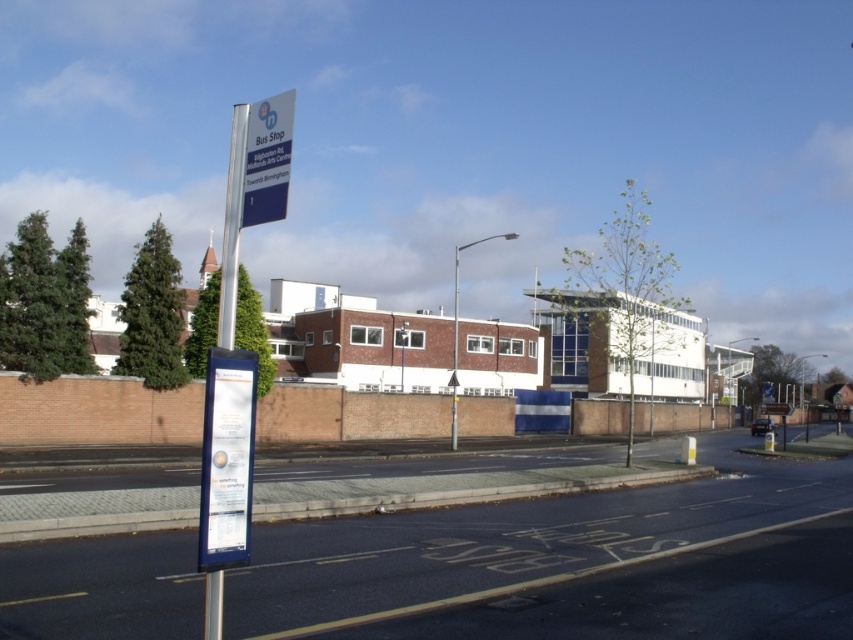
Is white plastic sign at center thinner than metallic pole at center?

No, white plastic sign at center is not thinner than metallic pole at center.

The height and width of the screenshot is (640, 853). I want to click on white plastic sign at center, so click(225, 458).

Which is in front, point (216, 378) or point (456, 300)?

Positioned in front is point (216, 378).

The height and width of the screenshot is (640, 853). Find the location of `white plastic sign at center`. white plastic sign at center is located at coordinates (225, 458).

Does blue plastic sign at upper center appear on the left side of metallic pole at center?

Correct, you'll find blue plastic sign at upper center to the left of metallic pole at center.

Does blue plastic sign at upper center have a smaller size compared to metallic pole at center?

Actually, blue plastic sign at upper center might be larger than metallic pole at center.

Does point (258, 161) lie in front of point (457, 346)?

That is True.

This screenshot has width=853, height=640. Find the location of `blue plastic sign at upper center`. blue plastic sign at upper center is located at coordinates (267, 160).

Does white plastic sign at center appear over blue plastic sign at upper center?

Actually, white plastic sign at center is below blue plastic sign at upper center.

Who is shorter, white plastic sign at center or blue plastic sign at upper center?

white plastic sign at center is shorter.

Is point (253, 388) in front of point (265, 200)?

No.

Where is `white plastic sign at center`? This screenshot has height=640, width=853. white plastic sign at center is located at coordinates (225, 458).